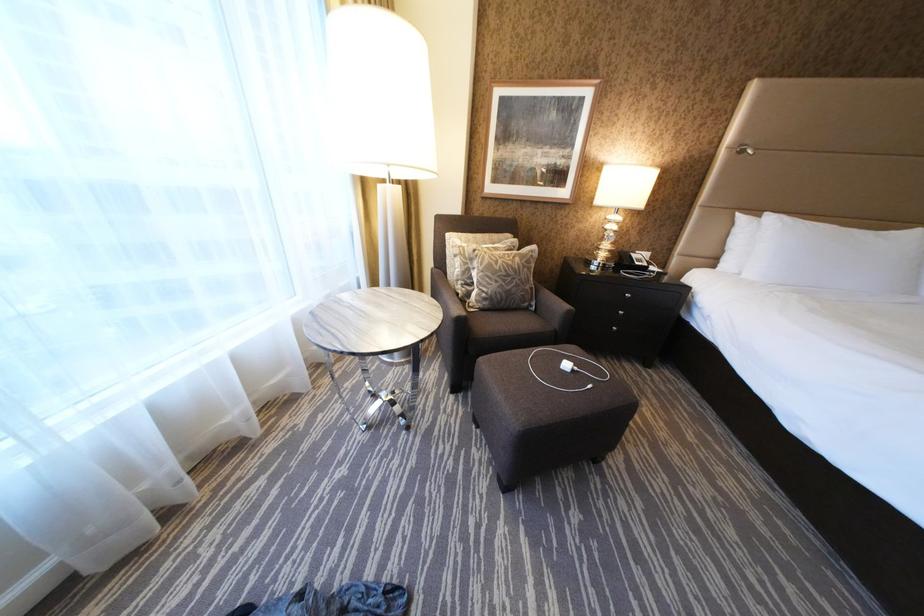
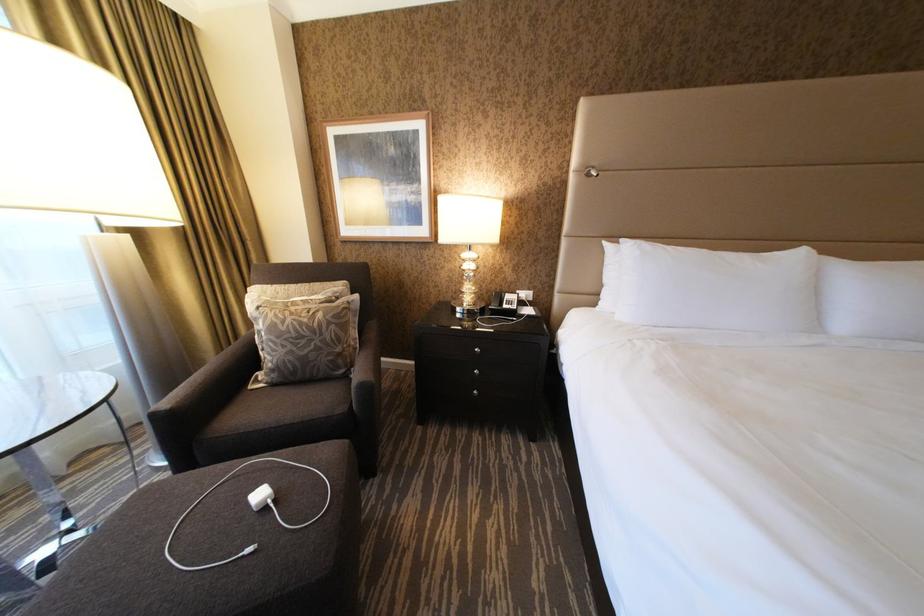
Question: What movement of the cameraman would produce the second image?

Choices:
 (A) Left
 (B) Right
 (C) Forward
 (D) Backward

Answer: (B)